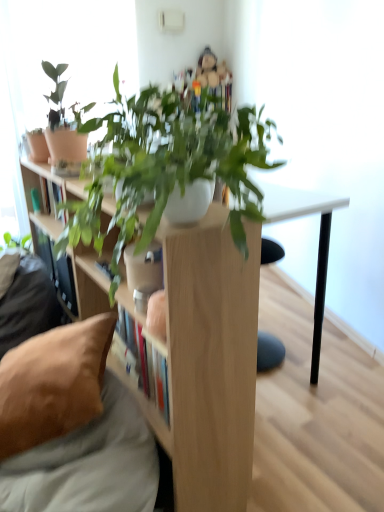
Question: Does brown fabric couch at lower left have a smaller size compared to brown fabric pillow at lower left?

Choices:
 (A) yes
 (B) no

Answer: (B)

Question: Is there a large distance between brown fabric couch at lower left and brown fabric pillow at lower left?

Choices:
 (A) no
 (B) yes

Answer: (A)

Question: Does brown fabric couch at lower left have a lesser height compared to brown fabric pillow at lower left?

Choices:
 (A) yes
 (B) no

Answer: (B)

Question: Considering the relative sizes of brown fabric couch at lower left and brown fabric pillow at lower left in the image provided, is brown fabric couch at lower left thinner than brown fabric pillow at lower left?

Choices:
 (A) yes
 (B) no

Answer: (A)

Question: Considering the relative positions of brown fabric couch at lower left and brown fabric pillow at lower left in the image provided, is brown fabric couch at lower left behind brown fabric pillow at lower left?

Choices:
 (A) no
 (B) yes

Answer: (A)

Question: In terms of size, does light wood shelf at center, positioned as the first shelf in right-to-left order, appear bigger or smaller than wooden bookshelf at left, the second shelf viewed from the right?

Choices:
 (A) small
 (B) big

Answer: (B)

Question: From the image's perspective, relative to wooden bookshelf at left, the second shelf viewed from the right, is light wood shelf at center, placed as the 2th shelf when sorted from left to right, above or below?

Choices:
 (A) below
 (B) above

Answer: (A)

Question: Is light wood shelf at center, positioned as the first shelf in right-to-left order, in front of or behind wooden bookshelf at left, which appears as the 1th shelf when viewed from the left, in the image?

Choices:
 (A) behind
 (B) front

Answer: (B)

Question: Based on their positions, is light wood shelf at center, positioned as the first shelf in right-to-left order, located to the left or right of wooden bookshelf at left, which appears as the 1th shelf when viewed from the left?

Choices:
 (A) left
 (B) right

Answer: (B)

Question: Considering the positions of point (140, 465) and point (97, 356), is point (140, 465) closer or farther from the camera than point (97, 356)?

Choices:
 (A) farther
 (B) closer

Answer: (B)

Question: Considering the positions of brown fabric couch at lower left and brown fabric pillow at lower left in the image, is brown fabric couch at lower left taller or shorter than brown fabric pillow at lower left?

Choices:
 (A) tall
 (B) short

Answer: (A)

Question: Would you say brown fabric couch at lower left is inside or outside brown fabric pillow at lower left?

Choices:
 (A) inside
 (B) outside

Answer: (B)

Question: Considering their positions, is brown fabric couch at lower left located in front of or behind brown fabric pillow at lower left?

Choices:
 (A) front
 (B) behind

Answer: (A)

Question: Is wooden bookshelf at left, the second shelf viewed from the right, taller or shorter than brown fabric pillow at lower left?

Choices:
 (A) short
 (B) tall

Answer: (B)

Question: Relative to brown fabric pillow at lower left, is wooden bookshelf at left, which appears as the 1th shelf when viewed from the left, in front or behind?

Choices:
 (A) behind
 (B) front

Answer: (A)